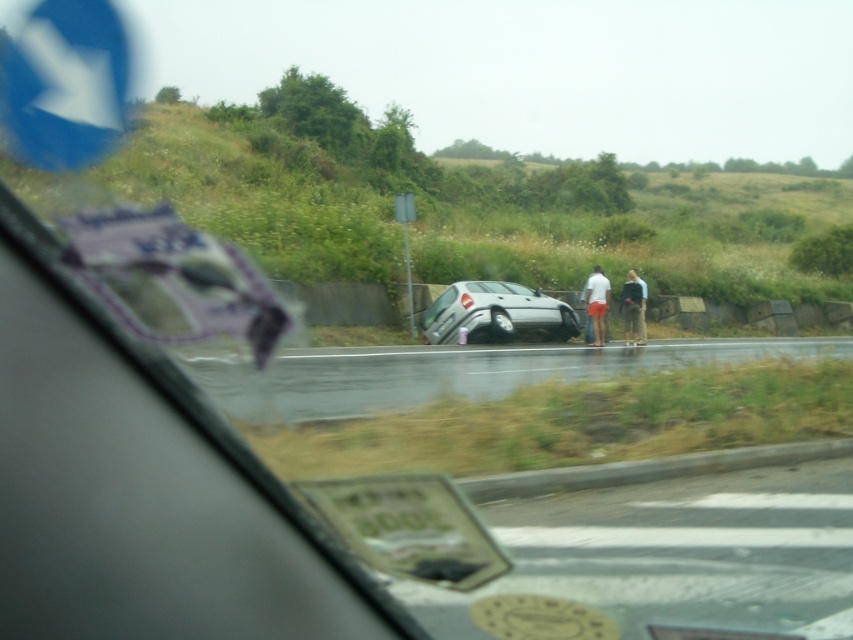
Can you confirm if silver metallic car at center is positioned to the left of matte white shorts at center?

Incorrect, silver metallic car at center is not on the left side of matte white shorts at center.

Which is behind, point (231, 417) or point (598, 266)?

The point (598, 266) is behind.

Is point (369, 372) positioned after point (604, 282)?

No.

The width and height of the screenshot is (853, 640). I want to click on silver metallic car at center, so click(x=450, y=371).

Is point (317, 368) positioned behind point (625, 291)?

No, (317, 368) is closer to viewer.

What do you see at coordinates (450, 371) in the screenshot?
I see `silver metallic car at center` at bounding box center [450, 371].

Describe the element at coordinates (450, 371) in the screenshot. This screenshot has height=640, width=853. I see `silver metallic car at center` at that location.

Locate an element on the screen. The height and width of the screenshot is (640, 853). silver metallic car at center is located at coordinates (450, 371).

Between point (590, 316) and point (642, 320), which one is positioned in front?

Point (590, 316) is in front.

Find the location of `matte white shorts at center`. matte white shorts at center is located at coordinates (595, 305).

Who is more forward, (602,296) or (639,342)?

Point (639,342)

At what (x,y) coordinates should I click in order to perform the action: click on matte white shorts at center. Please return your answer as a coordinate pair (x, y). The width and height of the screenshot is (853, 640). Looking at the image, I should click on (595, 305).